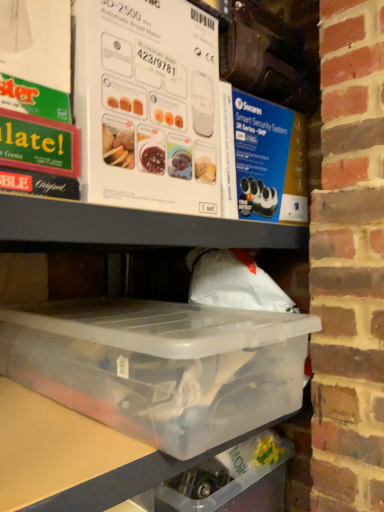
Question: From the image's perspective, relative to white cardboard box at upper center, arranged as the 2th box when ordered from the bottom, is transparent plastic container at lower center, which ranks as the 1th box in bottom-to-top order, above or below?

Choices:
 (A) above
 (B) below

Answer: (B)

Question: Is transparent plastic container at lower center, which ranks as the 1th box in bottom-to-top order, taller or shorter than white cardboard box at upper center, arranged as the 2th box when ordered from the bottom?

Choices:
 (A) short
 (B) tall

Answer: (A)

Question: From a real-world perspective, is transparent plastic container at lower center, which is counted as the 2th box, starting from the top, above or below white cardboard box at upper center, arranged as the 2th box when ordered from the bottom?

Choices:
 (A) above
 (B) below

Answer: (B)

Question: In terms of width, does white cardboard box at upper center, arranged as the 2th box when ordered from the bottom, look wider or thinner when compared to transparent plastic container at lower center, which ranks as the 1th box in bottom-to-top order?

Choices:
 (A) wide
 (B) thin

Answer: (B)

Question: Is white cardboard box at upper center, positioned as the 1th box in top-to-bottom order, in front of or behind transparent plastic container at lower center, which ranks as the 1th box in bottom-to-top order, in the image?

Choices:
 (A) front
 (B) behind

Answer: (B)

Question: Considering the positions of point (97, 13) and point (193, 391), is point (97, 13) closer or farther from the camera than point (193, 391)?

Choices:
 (A) farther
 (B) closer

Answer: (B)

Question: From a real-world perspective, relative to transparent plastic container at lower center, which ranks as the 1th box in bottom-to-top order, is white cardboard box at upper center, positioned as the 1th box in top-to-bottom order, vertically above or below?

Choices:
 (A) below
 (B) above

Answer: (B)